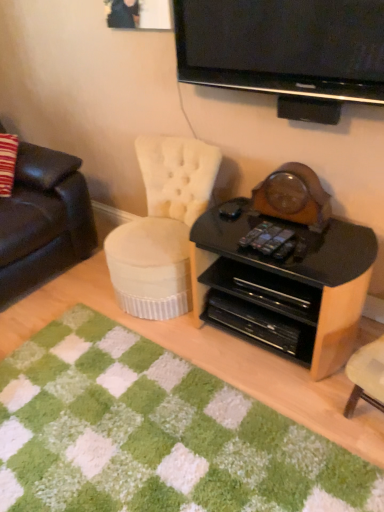
Identify the location of empty space that is ontop of black glossy desk at center (from a real-world perspective). (253, 228).